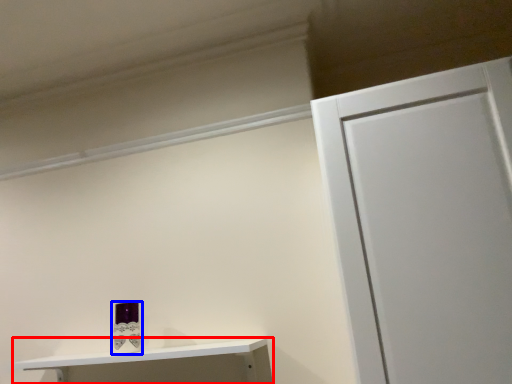
Question: Which point is further to the camera, shelf (highlighted by a red box) or toiletry (highlighted by a blue box)?

Choices:
 (A) shelf
 (B) toiletry

Answer: (B)